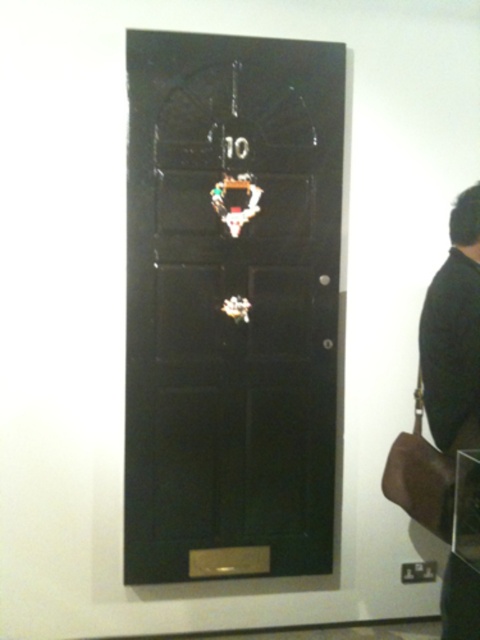
Between glossy black door at center and black leather jacket at right, which one appears on the left side from the viewer's perspective?

glossy black door at center

Can you confirm if glossy black door at center is taller than black leather jacket at right?

Yes.

Is point (210, 196) positioned in front of point (432, 380)?

No, (210, 196) is behind (432, 380).

Find the location of `glossy black door at center`. glossy black door at center is located at coordinates (232, 307).